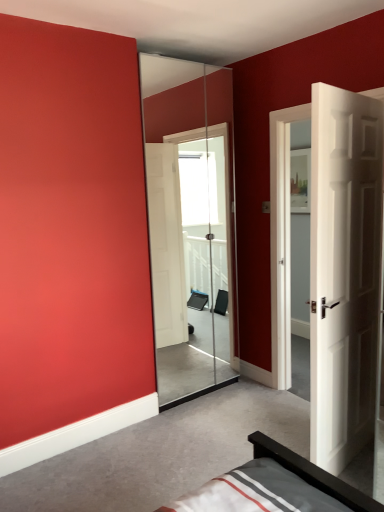
Where is `free spot to the right of transparent glass screen door at center`? The width and height of the screenshot is (384, 512). free spot to the right of transparent glass screen door at center is located at coordinates (247, 400).